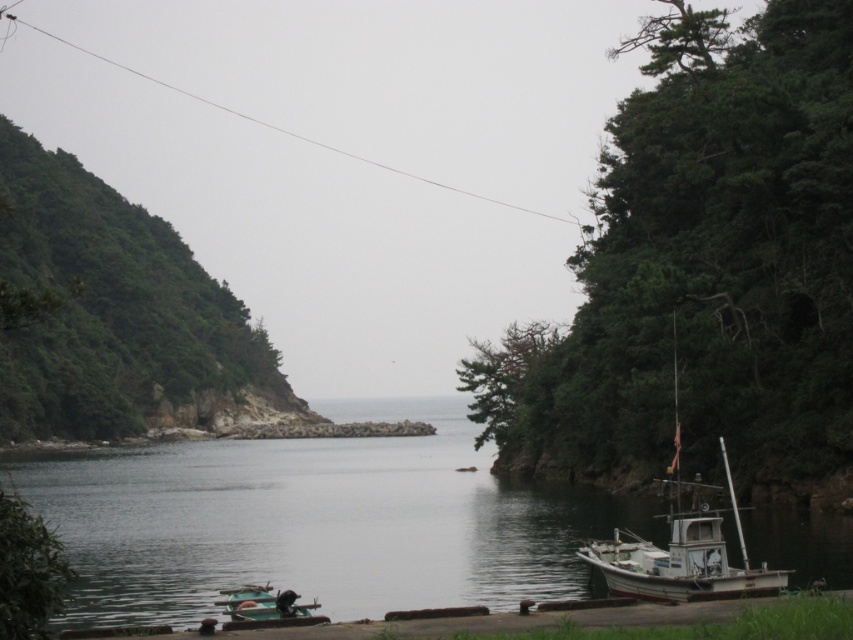
Can you confirm if green leafy hillside at left is positioned to the right of green matte boat at lower left?

Incorrect, green leafy hillside at left is not on the right side of green matte boat at lower left.

Who is lower down, green leafy hillside at left or green matte boat at lower left?

green matte boat at lower left is below.

Between point (106, 253) and point (303, 612), which one is positioned behind?

Positioned behind is point (106, 253).

Identify the location of green leafy hillside at left. The width and height of the screenshot is (853, 640). (109, 307).

Who is lower down, smooth dark water at center or green leafy hillside at left?

smooth dark water at center is below.

Is point (442, 467) closer to viewer compared to point (74, 193)?

Yes, point (442, 467) is in front of point (74, 193).

Find the location of `smooth dark water at center`. smooth dark water at center is located at coordinates (317, 522).

Is green leafy tree at right closer to camera compared to smooth dark water at center?

That is False.

Who is higher up, green leafy tree at right or smooth dark water at center?

Positioned higher is green leafy tree at right.

Between point (807, 369) and point (10, 477), which one is positioned behind?

Positioned behind is point (10, 477).

Locate an element on the screen. This screenshot has height=640, width=853. green leafy tree at right is located at coordinates (703, 273).